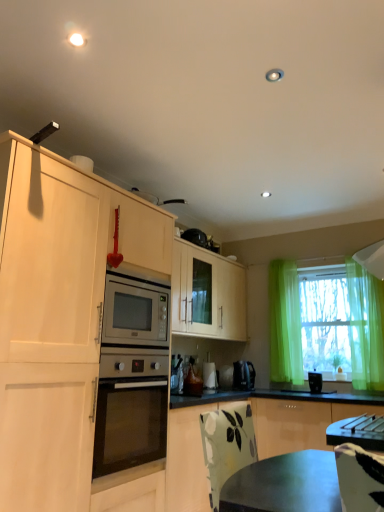
Where is `black plastic toaster at right, the third appliance from the back`? black plastic toaster at right, the third appliance from the back is located at coordinates (315, 382).

Find the location of a particular element. metallic silver toaster at center, the 2th appliance in the back-to-front sequence is located at coordinates (176, 375).

What is the approximate height of white glossy coffee maker at lower center, which is the 2th appliance from right to left?

white glossy coffee maker at lower center, which is the 2th appliance from right to left, is 13.64 inches in height.

In order to click on green sheer curtain at right in this screenshot , I will do `click(365, 328)`.

Measure the distance between green sheer curtain at right and camera.

green sheer curtain at right is 3.50 meters away from camera.

You are a GUI agent. You are given a task and a screenshot of the screen. Output one action in this format:
    pyautogui.click(x=<x>, y=<y>)
    Task: Click on the black plastic toaster at right, acting as the 1th appliance starting from the front
    The image size is (384, 512).
    Given the screenshot: What is the action you would take?
    pyautogui.click(x=315, y=382)

Are translucent green curtain at right and black plastic toaster at right, marked as the third appliance in a left-to-right arrangement, far apart?

No, translucent green curtain at right is not far from black plastic toaster at right, marked as the third appliance in a left-to-right arrangement.

Considering the sizes of objects translucent green curtain at right and black plastic toaster at right, which is the first appliance in right-to-left order, in the image provided, who is wider, translucent green curtain at right or black plastic toaster at right, which is the first appliance in right-to-left order,?

translucent green curtain at right.

In the scene shown: What's the angular difference between translucent green curtain at right and black plastic toaster at right, the third appliance from the back,'s facing directions?

The facing directions of translucent green curtain at right and black plastic toaster at right, the third appliance from the back, are 0.128 degrees apart.

From the image's perspective, between translucent green curtain at right and black plastic toaster at right, the third appliance from the back, who is located below?

From the image's view, black plastic toaster at right, the third appliance from the back, is below.

Can we say black plastic coffee maker at center lies outside metallic silver toaster at center, which is the third appliance from right to left?

Yes, black plastic coffee maker at center is located beyond the bounds of metallic silver toaster at center, which is the third appliance from right to left.

In order to click on kitchen appliance behind the metallic silver toaster at center, which is the third appliance from right to left in this screenshot , I will do `click(244, 375)`.

From a real-world perspective, is black plastic coffee maker at center beneath metallic silver toaster at center, the 2th appliance in the back-to-front sequence?

Yes, from a real-world perspective, black plastic coffee maker at center is beneath metallic silver toaster at center, the 2th appliance in the back-to-front sequence.

Considering the sizes of black plastic coffee maker at center and metallic silver toaster at center, which is the third appliance from right to left, in the image, is black plastic coffee maker at center taller or shorter than metallic silver toaster at center, which is the third appliance from right to left,?

black plastic coffee maker at center is shorter than metallic silver toaster at center, which is the third appliance from right to left.

From their relative heights in the image, would you say green sheer curtain at right is taller or shorter than white glossy coffee maker at lower center, which is the first appliance in back-to-front order?

Considering their sizes, green sheer curtain at right has more height than white glossy coffee maker at lower center, which is the first appliance in back-to-front order.

From the image's perspective, is green sheer curtain at right on top of white glossy coffee maker at lower center, which is the 2th appliance from right to left?

Yes, from the image's perspective, green sheer curtain at right is over white glossy coffee maker at lower center, which is the 2th appliance from right to left.

From a real-world perspective, count 1st appliances downward from the green sheer curtain at right and point to it. Please provide its 2D coordinates.

[(209, 374)]

Between point (356, 356) and point (212, 362), which one is positioned behind?

The point (212, 362) is farther.

From the image's perspective, is white glossy coffee maker at lower center, which is counted as the second appliance, starting from the left, positioned above or below metallic silver toaster at center, which is counted as the first appliance, starting from the left?

white glossy coffee maker at lower center, which is counted as the second appliance, starting from the left, is situated lower than metallic silver toaster at center, which is counted as the first appliance, starting from the left, in the image.

Is white glossy coffee maker at lower center, which is the first appliance in back-to-front order, shorter than metallic silver toaster at center, which is the third appliance from right to left?

In fact, white glossy coffee maker at lower center, which is the first appliance in back-to-front order, may be taller than metallic silver toaster at center, which is the third appliance from right to left.

Looking at this image, is white glossy coffee maker at lower center, which is counted as the second appliance, starting from the left, positioned beyond the bounds of metallic silver toaster at center, which is counted as the first appliance, starting from the left?

white glossy coffee maker at lower center, which is counted as the second appliance, starting from the left, is positioned outside metallic silver toaster at center, which is counted as the first appliance, starting from the left.

Between white glossy coffee maker at lower center, which is counted as the second appliance, starting from the left, and green matte cabinet at lower right, which one has larger size?

green matte cabinet at lower right is bigger.

From a real-world perspective, does white glossy coffee maker at lower center, the third appliance in the front-to-back sequence, sit lower than green matte cabinet at lower right?

No, from a real-world perspective, white glossy coffee maker at lower center, the third appliance in the front-to-back sequence, is not under green matte cabinet at lower right.

At what (x,y) coordinates should I click in order to perform the action: click on cabinetry in front of the white glossy coffee maker at lower center, which is the 2th appliance from right to left. Please return your answer as a coordinate pair (x, y). The width and height of the screenshot is (384, 512). Looking at the image, I should click on (255, 434).

From a real-world perspective, is green matte cabinet at lower right above or below white glossy coffee maker at lower center, the third appliance in the front-to-back sequence?

From a real-world perspective, green matte cabinet at lower right is physically below white glossy coffee maker at lower center, the third appliance in the front-to-back sequence.

Visually, is green matte cabinet at lower right positioned to the left or to the right of white glossy coffee maker at lower center, which is counted as the second appliance, starting from the left?

Clearly, green matte cabinet at lower right is on the right of white glossy coffee maker at lower center, which is counted as the second appliance, starting from the left, in the image.

Where is `cabinetry that is above the white glossy coffee maker at lower center, which is the first appliance in back-to-front order (from the image's perspective)`? The height and width of the screenshot is (512, 384). cabinetry that is above the white glossy coffee maker at lower center, which is the first appliance in back-to-front order (from the image's perspective) is located at coordinates (255, 434).

Between green matte cabinet at lower right and white glossy coffee maker at lower center, which is counted as the second appliance, starting from the left, which one has less height?

With less height is white glossy coffee maker at lower center, which is counted as the second appliance, starting from the left.

In terms of height, does white glossy coffee maker at lower center, which is counted as the second appliance, starting from the left, look taller or shorter compared to black plastic toaster at right, the third appliance from the back?

white glossy coffee maker at lower center, which is counted as the second appliance, starting from the left, is taller than black plastic toaster at right, the third appliance from the back.

Can you confirm if white glossy coffee maker at lower center, the third appliance in the front-to-back sequence, is wider than black plastic toaster at right, the third appliance from the back?

Incorrect, the width of white glossy coffee maker at lower center, the third appliance in the front-to-back sequence, does not surpass that of black plastic toaster at right, the third appliance from the back.

From the picture: From a real-world perspective, which object rests below the other?

black plastic toaster at right, marked as the third appliance in a left-to-right arrangement, is physically lower.

Is white glossy coffee maker at lower center, which is the 2th appliance from right to left, oriented away from black plastic toaster at right, acting as the 1th appliance starting from the front?

No, white glossy coffee maker at lower center, which is the 2th appliance from right to left, is not facing the opposite direction of black plastic toaster at right, acting as the 1th appliance starting from the front.

The height and width of the screenshot is (512, 384). I want to click on the 1st appliance counting from the left of the translucent green curtain at right, so point(315,382).

From the image's perspective, which appliance is the 3rd one above the black plastic coffee maker at center? Please provide its 2D coordinates.

[(176, 375)]

Which object lies nearer to the anchor point translucent green curtain at right, green sheer curtain at right or metallic silver toaster at center, which is counted as the first appliance, starting from the left?

green sheer curtain at right is positioned closer to the anchor translucent green curtain at right.

Which object lies nearer to the anchor point black plastic coffee maker at center, green matte cabinet at lower right or green sheer curtain at right?

green matte cabinet at lower right lies closer to black plastic coffee maker at center than the other object.

Estimate the real-world distances between objects in this image. Which object is closer to green matte cabinet at lower right, black plastic toaster at right, the third appliance from the back, or translucent green curtain at right?

translucent green curtain at right is positioned closer to the anchor green matte cabinet at lower right.

Looking at the image, which one is located further to translucent green curtain at right, green matte cabinet at lower right or white glossy coffee maker at lower center, which is the 2th appliance from right to left?

white glossy coffee maker at lower center, which is the 2th appliance from right to left.

Looking at the image, which one is located closer to black plastic toaster at right, which is the first appliance in right-to-left order, white glossy coffee maker at lower center, which is the first appliance in back-to-front order, or black plastic coffee maker at center?

The object closer to black plastic toaster at right, which is the first appliance in right-to-left order, is black plastic coffee maker at center.

Looking at the image, which one is located closer to white glossy coffee maker at lower center, the third appliance in the front-to-back sequence, green matte cabinet at lower right or metallic silver toaster at center, positioned as the 2th appliance in front-to-back order?

metallic silver toaster at center, positioned as the 2th appliance in front-to-back order.

When comparing their distances from black plastic toaster at right, which is the first appliance in right-to-left order, does green matte cabinet at lower right or metallic silver toaster at center, the 2th appliance in the back-to-front sequence, seem further?

Based on the image, metallic silver toaster at center, the 2th appliance in the back-to-front sequence, appears to be further to black plastic toaster at right, which is the first appliance in right-to-left order.

From the image, which object appears to be farther from green matte cabinet at lower right, translucent green curtain at right or metallic silver toaster at center, which is the third appliance from right to left?

metallic silver toaster at center, which is the third appliance from right to left, lies further to green matte cabinet at lower right than the other object.

At what (x,y) coordinates should I click in order to perform the action: click on appliance located between white glossy coffee maker at lower center, which is the first appliance in back-to-front order, and translucent green curtain at right in the left-right direction. Please return your answer as a coordinate pair (x, y). Looking at the image, I should click on (315, 382).

You are a GUI agent. You are given a task and a screenshot of the screen. Output one action in this format:
    pyautogui.click(x=<x>, y=<y>)
    Task: Click on the appliance between white glossy coffee maker at lower center, which is the 2th appliance from right to left, and green sheer curtain at right
    This screenshot has height=512, width=384.
    Given the screenshot: What is the action you would take?
    pyautogui.click(x=315, y=382)

This screenshot has height=512, width=384. Find the location of `kitchen appliance located between white glossy coffee maker at lower center, which is counted as the second appliance, starting from the left, and black plastic toaster at right, the third appliance from the back, in the left-right direction`. kitchen appliance located between white glossy coffee maker at lower center, which is counted as the second appliance, starting from the left, and black plastic toaster at right, the third appliance from the back, in the left-right direction is located at coordinates (244, 375).

This screenshot has height=512, width=384. I want to click on window between green sheer curtain at right and black plastic toaster at right, the third appliance from the back, from top to bottom, so click(x=326, y=325).